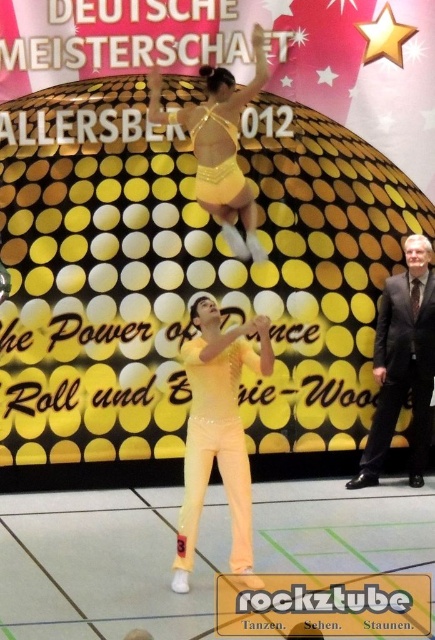
Is matte yellow pants at center wider than yellow satin dress at center?

Yes.

Between point (224, 362) and point (207, 177), which one is positioned behind?

The point (207, 177) is more distant.

Locate an element on the screen. Image resolution: width=435 pixels, height=640 pixels. matte yellow pants at center is located at coordinates (217, 429).

Describe the element at coordinates (402, 364) in the screenshot. I see `dark gray suit at right` at that location.

Is the position of dark gray suit at right more distant than that of yellow satin dress at center?

Yes.

At what (x,y) coordinates should I click in order to perform the action: click on dark gray suit at right. Please return your answer as a coordinate pair (x, y). The width and height of the screenshot is (435, 640). Looking at the image, I should click on pos(402,364).

The image size is (435, 640). What are the coordinates of `dark gray suit at right` in the screenshot? It's located at (402, 364).

Can you confirm if matte yellow pants at center is bigger than dark gray suit at right?

Indeed, matte yellow pants at center has a larger size compared to dark gray suit at right.

Who is taller, matte yellow pants at center or dark gray suit at right?

Standing taller between the two is dark gray suit at right.

Between point (241, 563) and point (428, 257), which one is positioned behind?

Positioned behind is point (428, 257).

The image size is (435, 640). I want to click on matte yellow pants at center, so click(217, 429).